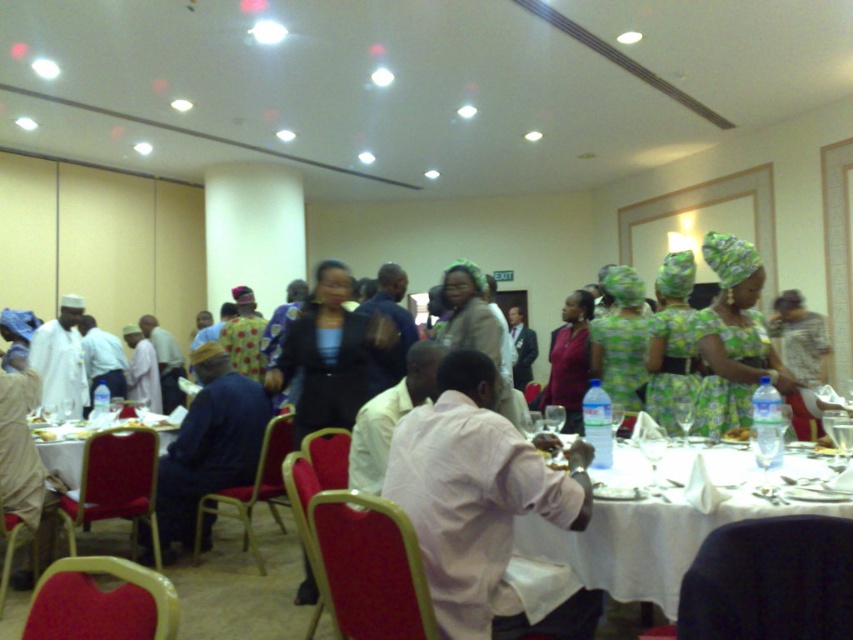
Question: Which point is closer to the camera?

Choices:
 (A) (44, 330)
 (B) (648, 579)

Answer: (B)

Question: Which of the following is the closest to the observer?

Choices:
 (A) white tablecloth at lower left
 (B) white cloth at center

Answer: (B)

Question: Which point is closer to the camera?

Choices:
 (A) green printed dress at center
 (B) printed fabric dress at center
 (C) white matte shirt at center

Answer: (C)

Question: Does green printed dress at center lie in front of matte pink blouse at center?

Choices:
 (A) yes
 (B) no

Answer: (A)

Question: Does white cloth at center come behind white matte shirt at left?

Choices:
 (A) no
 (B) yes

Answer: (A)

Question: Is dark blue shirt at center bigger than white tablecloth at lower left?

Choices:
 (A) no
 (B) yes

Answer: (B)